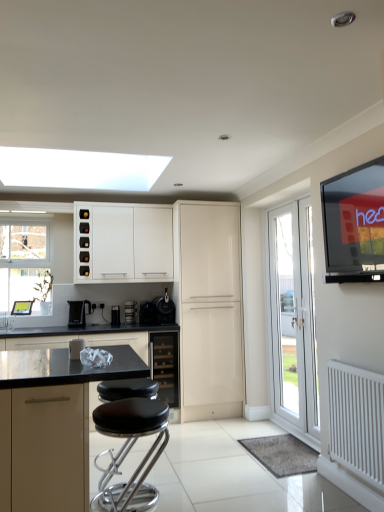
Question: Considering the positions of flat-screen tv at upper right and glossy cream cabinet at center, which is counted as the 2th cabinetry, starting from the back, in the image, is flat-screen tv at upper right bigger or smaller than glossy cream cabinet at center, which is counted as the 2th cabinetry, starting from the back,?

Choices:
 (A) big
 (B) small

Answer: (B)

Question: Visually, is flat-screen tv at upper right positioned to the left or to the right of glossy cream cabinet at center, placed as the 4th cabinetry when sorted from front to back?

Choices:
 (A) right
 (B) left

Answer: (A)

Question: Which object is positioned farthest from the black matte coffee maker at center, the first appliance when ordered from right to left?

Choices:
 (A) satin black wine cooler at center, which is the 3th appliance in left-to-right order
 (B) white matte cabinet at upper left, which is the fifth cabinetry in front-to-back order
 (C) glossy cream cabinet at center, which is counted as the 2th cabinetry, starting from the back
 (D) black plastic toaster at center, which ranks as the 3th appliance in right-to-left order
 (E) white matte radiator at lower right

Answer: (E)

Question: Estimate the real-world distances between objects in this image. Which object is farther from the black matte countertop at center, placed as the 4th cabinetry when sorted from back to front?

Choices:
 (A) black glass wine cooler at center, which is the 3th cabinetry in back-to-front order
 (B) white glossy door at right
 (C) black plastic toaster at center, the 1th appliance from the left
 (D) glossy cream cabinet at center, which is counted as the 2th cabinetry, starting from the back
 (E) black matte coffee maker at center, the first appliance when ordered from right to left

Answer: (B)